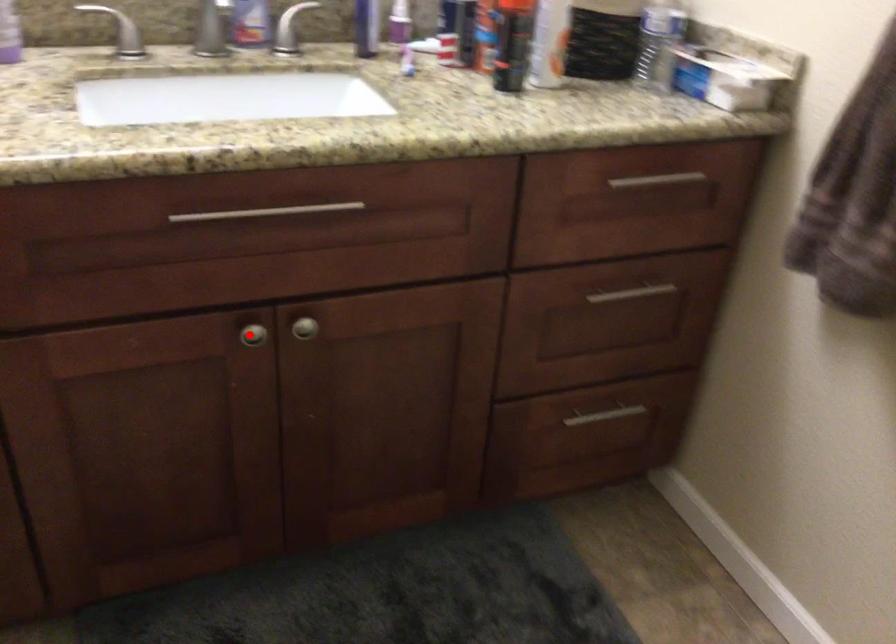
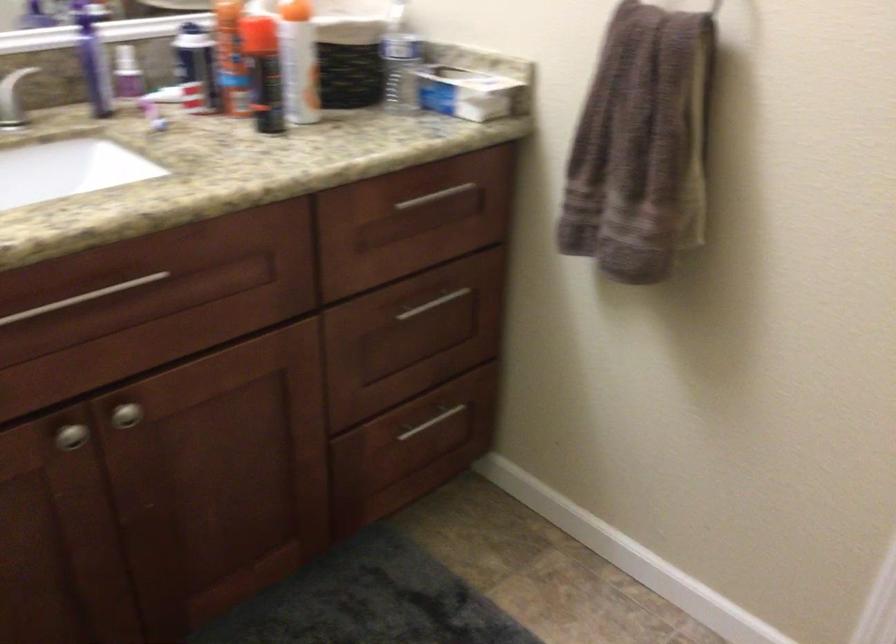
Question: I am providing you with two images of the same scene from different viewpoints. A red point is shown in image1. For the corresponding object point in image2, is it positioned nearer or farther from the camera?

Choices:
 (A) Nearer
 (B) Farther

Answer: (A)